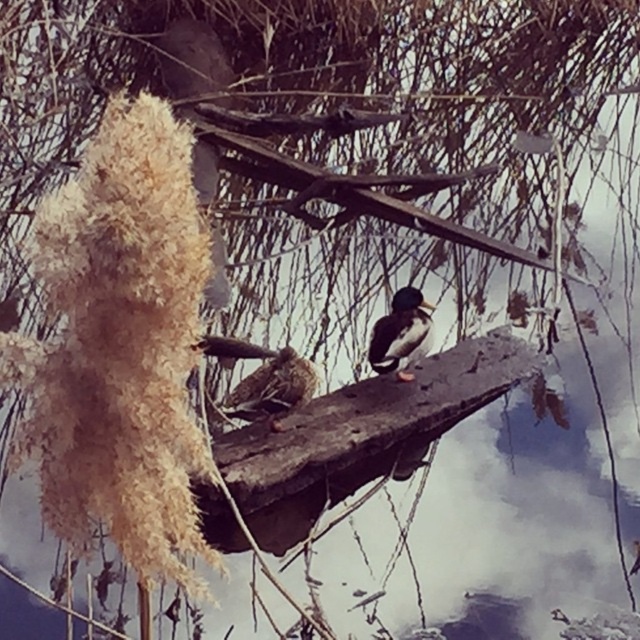
Between brown speckled feathers at center and shiny brown duck at center, which one is positioned lower?

Positioned lower is brown speckled feathers at center.

Is brown speckled feathers at center shorter than shiny brown duck at center?

Yes.

The image size is (640, 640). What do you see at coordinates (273, 388) in the screenshot?
I see `brown speckled feathers at center` at bounding box center [273, 388].

Find the location of a particular element. Image resolution: width=640 pixels, height=640 pixels. brown speckled feathers at center is located at coordinates (273, 388).